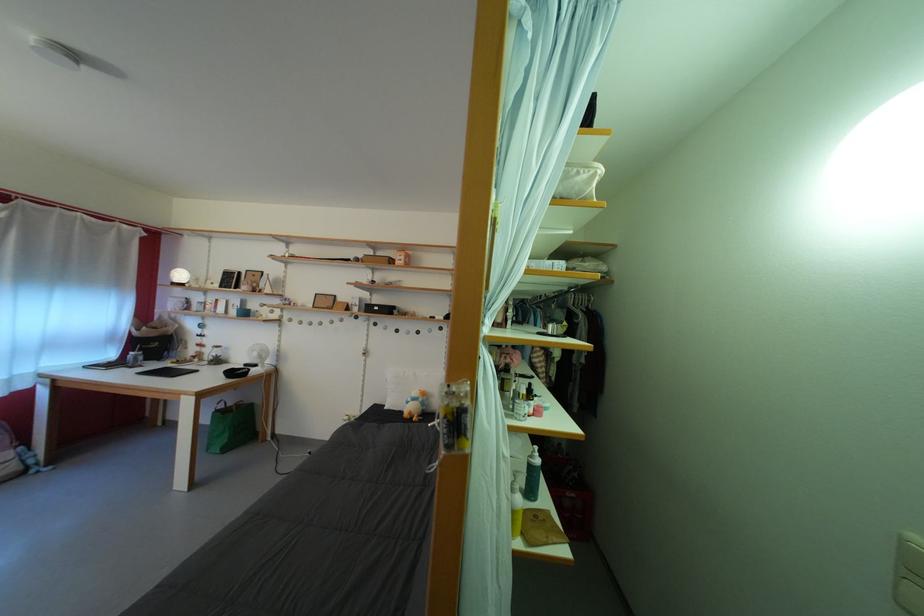
The width and height of the screenshot is (924, 616). What do you see at coordinates (533, 456) in the screenshot?
I see `the white pump bottle top` at bounding box center [533, 456].